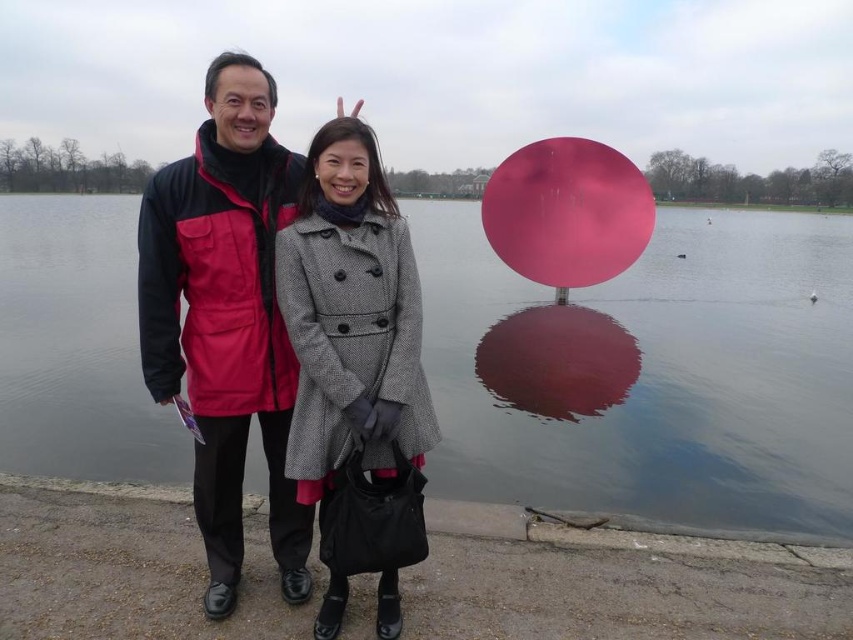
You are a photographer trying to capture a clear shot of the matte black jacket at center without the pink glossy water at center obstructing it. Which object should you move closer to or farther from to achieve this?

To capture a clear shot of the matte black jacket at center without the pink glossy water at center obstructing it, you should move closer to the matte black jacket at center. Since the matte black jacket is behind the pink glossy water, moving closer to the jacket will reduce the water appearing in front of it, allowing for a clearer focus on the jacket.

You are taking a photo of two people standing near a lake. You want to focus on the person on the right. Which point, point (238, 499) or point (393, 262), should you adjust your camera focus to ensure the person on the right is in focus?

To focus on the person on the right, you should adjust your camera focus to point (393, 262) because it is closer to the camera than point (238, 499).